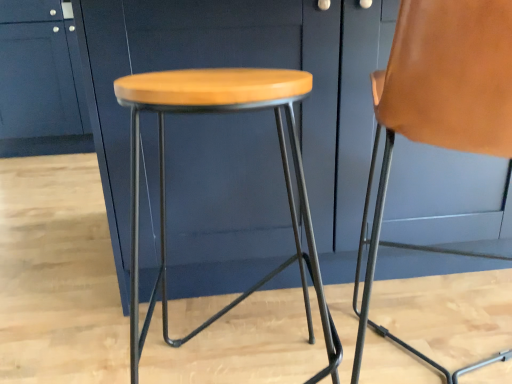
In order to face matte blue cabinet at center, which is counted as the second cabinetry, starting from the back, should I rotate leftwards or rightwards?

You should rotate right by 18.424 degrees.

The width and height of the screenshot is (512, 384). Describe the element at coordinates (41, 81) in the screenshot. I see `matte blue cabinet at upper left, the first cabinetry when ordered from left to right` at that location.

What do you see at coordinates (164, 178) in the screenshot? Image resolution: width=512 pixels, height=384 pixels. I see `wooden seat stool at center` at bounding box center [164, 178].

This screenshot has height=384, width=512. In order to click on brown leather chair at right in this screenshot , I will do [403, 126].

This screenshot has width=512, height=384. Describe the element at coordinates (403, 126) in the screenshot. I see `brown leather chair at right` at that location.

Locate an element on the screen. The image size is (512, 384). matte blue cabinet at center, the first cabinetry when ordered from front to back is located at coordinates (210, 67).

Considering the relative sizes of brown leather chair at right and wooden seat stool at center in the image provided, is brown leather chair at right thinner than wooden seat stool at center?

No, brown leather chair at right is not thinner than wooden seat stool at center.

How many degrees apart are the facing directions of brown leather chair at right and wooden seat stool at center?

They differ by 4.41 degrees in their facing directions.

Is wooden seat stool at center located within brown leather chair at right?

That's incorrect, wooden seat stool at center is not inside brown leather chair at right.

From a real-world perspective, between brown leather chair at right and wooden seat stool at center, who is vertically higher?

In real-world perspective, brown leather chair at right is above.

Where is `the 2nd cabinetry above the wooden seat stool at center (from the image's perspective)`? This screenshot has width=512, height=384. the 2nd cabinetry above the wooden seat stool at center (from the image's perspective) is located at coordinates (41, 81).

Is matte blue cabinet at upper left, which is the 2th cabinetry in right-to-left order, closer to camera compared to wooden seat stool at center?

No, matte blue cabinet at upper left, which is the 2th cabinetry in right-to-left order, is behind wooden seat stool at center.

Is matte blue cabinet at upper left, positioned as the first cabinetry in back-to-front order, positioned with its back to wooden seat stool at center?

matte blue cabinet at upper left, positioned as the first cabinetry in back-to-front order, is not turned away from wooden seat stool at center.

Does wooden seat stool at center touch brown leather chair at right?

wooden seat stool at center and brown leather chair at right are clearly separated.

From the image's perspective, is wooden seat stool at center positioned above or below brown leather chair at right?

From the image's perspective, wooden seat stool at center appears below brown leather chair at right.

How far apart are wooden seat stool at center and brown leather chair at right?

wooden seat stool at center and brown leather chair at right are 10.27 inches apart.

Can you tell me how much wooden seat stool at center and brown leather chair at right differ in facing direction?

wooden seat stool at center and brown leather chair at right are facing 4.41 degrees away from each other.

Would you say wooden seat stool at center is inside or outside matte blue cabinet at upper left, the first cabinetry when ordered from left to right?

wooden seat stool at center cannot be found inside matte blue cabinet at upper left, the first cabinetry when ordered from left to right.

In the image, is wooden seat stool at center on the left side or the right side of matte blue cabinet at upper left, which is the 2th cabinetry in right-to-left order?

Clearly, wooden seat stool at center is on the right of matte blue cabinet at upper left, which is the 2th cabinetry in right-to-left order, in the image.

From the image's perspective, between wooden seat stool at center and matte blue cabinet at upper left, which is the 2th cabinetry in right-to-left order, who is located below?

wooden seat stool at center is shown below in the image.

Relative to brown leather chair at right, is matte blue cabinet at upper left, which appears as the 2th cabinetry when viewed from the front, in front or behind?

matte blue cabinet at upper left, which appears as the 2th cabinetry when viewed from the front, is behind brown leather chair at right.

Between point (49, 4) and point (475, 69), which one is positioned in front?

The point (475, 69) is closer to the camera.

Looking at this image, from the image's perspective, which one is positioned lower, matte blue cabinet at upper left, which is the 2th cabinetry in right-to-left order, or brown leather chair at right?

brown leather chair at right.

Is matte blue cabinet at upper left, which appears as the 2th cabinetry when viewed from the front, located within matte blue cabinet at center, which is counted as the second cabinetry, starting from the back?

No, matte blue cabinet at upper left, which appears as the 2th cabinetry when viewed from the front, is not a part of matte blue cabinet at center, which is counted as the second cabinetry, starting from the back.

From the image's perspective, is matte blue cabinet at center, acting as the second cabinetry starting from the left, located above or below matte blue cabinet at upper left, which is the 2th cabinetry in right-to-left order?

Clearly, from the image's perspective, matte blue cabinet at center, acting as the second cabinetry starting from the left, is below matte blue cabinet at upper left, which is the 2th cabinetry in right-to-left order.

Locate an element on the screen. cabinetry behind the matte blue cabinet at center, acting as the second cabinetry starting from the left is located at coordinates (41, 81).

Is matte blue cabinet at center, acting as the second cabinetry starting from the left, at the right side of matte blue cabinet at upper left, positioned as the first cabinetry in back-to-front order?

Yes, matte blue cabinet at center, acting as the second cabinetry starting from the left, is to the right of matte blue cabinet at upper left, positioned as the first cabinetry in back-to-front order.

Can we say brown leather chair at right lies outside matte blue cabinet at upper left, positioned as the first cabinetry in back-to-front order?

brown leather chair at right is positioned outside matte blue cabinet at upper left, positioned as the first cabinetry in back-to-front order.

Between point (454, 141) and point (13, 124), which one is positioned behind?

The point (13, 124) is behind.

Is brown leather chair at right taller or shorter than matte blue cabinet at upper left, which is the 2th cabinetry in right-to-left order?

Considering their sizes, brown leather chair at right has less height than matte blue cabinet at upper left, which is the 2th cabinetry in right-to-left order.

Which of these two, brown leather chair at right or matte blue cabinet at upper left, the first cabinetry when ordered from left to right, is wider?

With larger width is matte blue cabinet at upper left, the first cabinetry when ordered from left to right.

At what (x,y) coordinates should I click in order to perform the action: click on chair to the right of wooden seat stool at center. Please return your answer as a coordinate pair (x, y). The width and height of the screenshot is (512, 384). Looking at the image, I should click on (403, 126).

From a real-world perspective, which cabinetry is the 2nd one above the wooden seat stool at center? Please provide its 2D coordinates.

[(41, 81)]

Estimate the real-world distances between objects in this image. Which object is further from matte blue cabinet at center, arranged as the first cabinetry when viewed from the right, brown leather chair at right or matte blue cabinet at upper left, positioned as the first cabinetry in back-to-front order?

The object further to matte blue cabinet at center, arranged as the first cabinetry when viewed from the right, is matte blue cabinet at upper left, positioned as the first cabinetry in back-to-front order.

When comparing their distances from matte blue cabinet at center, the first cabinetry when ordered from front to back, does brown leather chair at right or wooden seat stool at center seem closer?

wooden seat stool at center is positioned closer to the anchor matte blue cabinet at center, the first cabinetry when ordered from front to back.

Estimate the real-world distances between objects in this image. Which object is further from wooden seat stool at center, matte blue cabinet at center, acting as the second cabinetry starting from the left, or matte blue cabinet at upper left, which appears as the 2th cabinetry when viewed from the front?

matte blue cabinet at upper left, which appears as the 2th cabinetry when viewed from the front, is further to wooden seat stool at center.

Considering their positions, is wooden seat stool at center positioned further to matte blue cabinet at upper left, which is the 2th cabinetry in right-to-left order, than matte blue cabinet at center, which is counted as the second cabinetry, starting from the back?

The object further to matte blue cabinet at upper left, which is the 2th cabinetry in right-to-left order, is wooden seat stool at center.

Based on their spatial positions, is matte blue cabinet at center, acting as the second cabinetry starting from the left, or matte blue cabinet at upper left, positioned as the first cabinetry in back-to-front order, further from brown leather chair at right?

Among the two, matte blue cabinet at upper left, positioned as the first cabinetry in back-to-front order, is located further to brown leather chair at right.

Estimate the real-world distances between objects in this image. Which object is further from wooden seat stool at center, matte blue cabinet at center, which is counted as the second cabinetry, starting from the back, or brown leather chair at right?

Based on the image, brown leather chair at right appears to be further to wooden seat stool at center.

When comparing their distances from wooden seat stool at center, does matte blue cabinet at upper left, the first cabinetry when ordered from left to right, or matte blue cabinet at center, the first cabinetry when ordered from front to back, seem further?

matte blue cabinet at upper left, the first cabinetry when ordered from left to right, is further to wooden seat stool at center.

Estimate the real-world distances between objects in this image. Which object is closer to brown leather chair at right, matte blue cabinet at upper left, which appears as the 2th cabinetry when viewed from the front, or matte blue cabinet at center, the first cabinetry when ordered from front to back?

Based on the image, matte blue cabinet at center, the first cabinetry when ordered from front to back, appears to be nearer to brown leather chair at right.

The image size is (512, 384). Identify the location of stool located between brown leather chair at right and matte blue cabinet at upper left, which is the 2th cabinetry in right-to-left order, in the depth direction. (164, 178).

This screenshot has height=384, width=512. Find the location of `cabinetry between wooden seat stool at center and matte blue cabinet at upper left, which appears as the 2th cabinetry when viewed from the front, from front to back`. cabinetry between wooden seat stool at center and matte blue cabinet at upper left, which appears as the 2th cabinetry when viewed from the front, from front to back is located at coordinates (210, 67).

Where is `cabinetry between brown leather chair at right and matte blue cabinet at upper left, the first cabinetry when ordered from left to right, along the z-axis`? cabinetry between brown leather chair at right and matte blue cabinet at upper left, the first cabinetry when ordered from left to right, along the z-axis is located at coordinates (210, 67).

The height and width of the screenshot is (384, 512). Find the location of `chair between wooden seat stool at center and matte blue cabinet at center, acting as the second cabinetry starting from the left, in the horizontal direction`. chair between wooden seat stool at center and matte blue cabinet at center, acting as the second cabinetry starting from the left, in the horizontal direction is located at coordinates (403, 126).